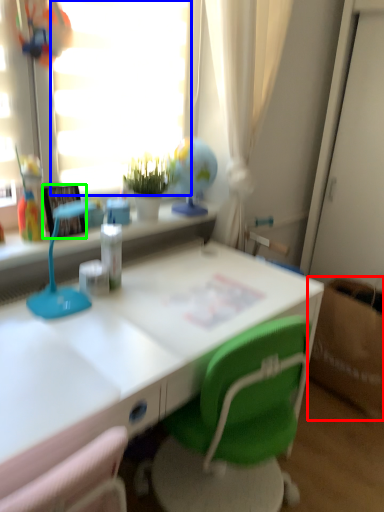
Question: Which object is positioned closest to cardboard box (highlighted by a red box)? Select from window screen (highlighted by a blue box) and picture frame (highlighted by a green box).

Choices:
 (A) window screen
 (B) picture frame

Answer: (A)